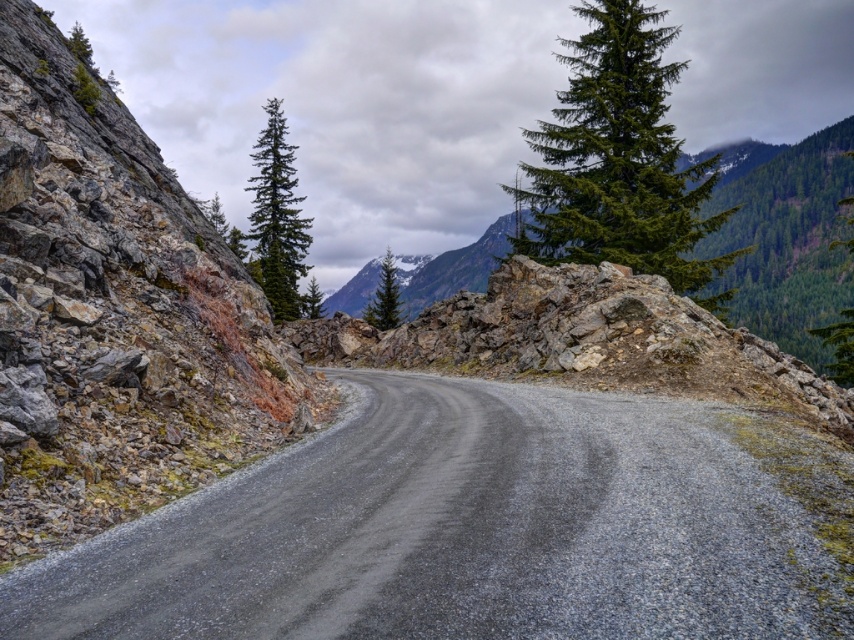
Between green matte evergreen tree at upper center and green needle-like tree at upper center, which one is positioned lower?

green needle-like tree at upper center is below.

This screenshot has width=854, height=640. What do you see at coordinates (619, 161) in the screenshot?
I see `green matte evergreen tree at upper center` at bounding box center [619, 161].

Locate an element on the screen. green matte evergreen tree at upper center is located at coordinates (619, 161).

Is point (4, 241) in front of point (320, 298)?

That is True.

Can you confirm if rocky gray at left is shorter than green matte tree at center?

Incorrect, rocky gray at left's height does not fall short of green matte tree at center's.

Between point (115, 460) and point (316, 316), which one is positioned in front?

Point (115, 460) is more forward.

Find the location of a particular element. The height and width of the screenshot is (640, 854). rocky gray at left is located at coordinates (114, 314).

Which is below, gray asphalt road at center or green matte evergreen tree at upper center?

gray asphalt road at center is lower down.

Is point (162, 560) behind point (529, 193)?

No, it is in front of (529, 193).

Find the location of a particular element. This screenshot has width=854, height=640. gray asphalt road at center is located at coordinates (480, 528).